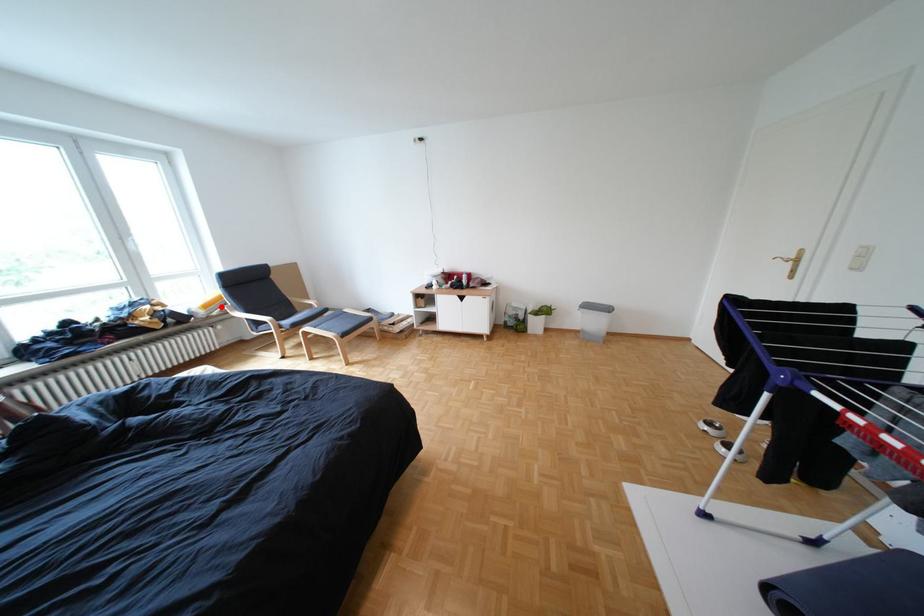
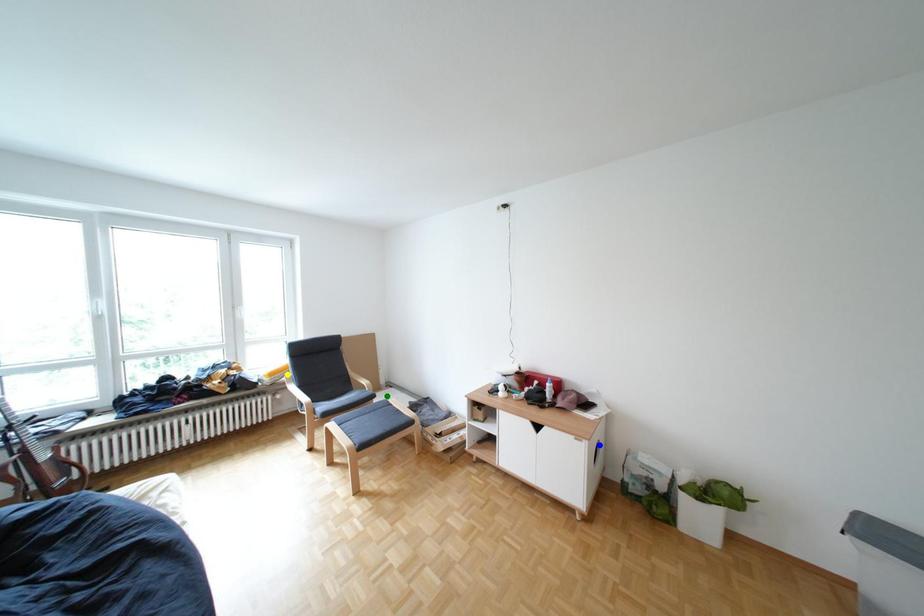
Question: I am providing you with two images of the same scene from different viewpoints. A red point is marked on the first image. You are given multiple points on the second image. Which point in image 2 is actually the same real-world point as the red point in image 1?

Choices:
 (A) green point
 (B) blue point
 (C) yellow point

Answer: (C)